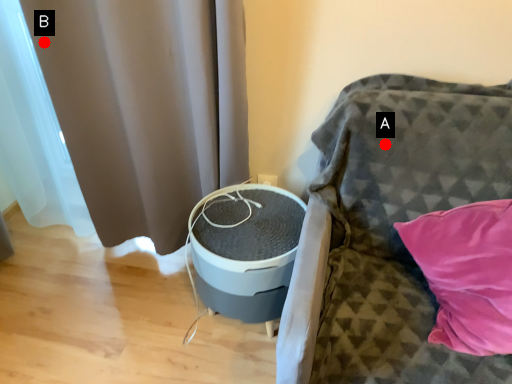
Question: Two points are circled on the image, labeled by A and B beside each circle. Which point is closer to the camera?

Choices:
 (A) A is closer
 (B) B is closer

Answer: (A)